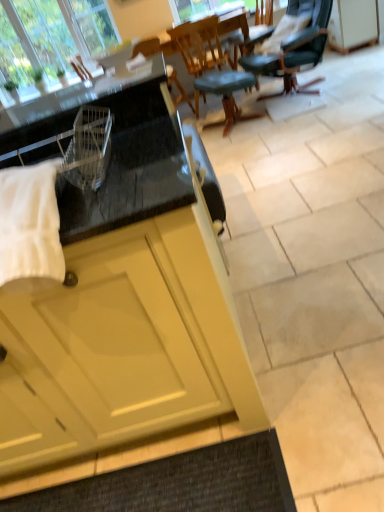
Question: Considering the relative sizes of clear glass window at upper left and wooden chair at center, which appears as the first chair when viewed from the left, in the image provided, is clear glass window at upper left wider than wooden chair at center, which appears as the first chair when viewed from the left,?

Choices:
 (A) yes
 (B) no

Answer: (B)

Question: Can you confirm if clear glass window at upper left is thinner than wooden chair at center, which appears as the second chair when viewed from the right?

Choices:
 (A) yes
 (B) no

Answer: (A)

Question: Considering the relative sizes of clear glass window at upper left and wooden chair at center, which appears as the second chair when viewed from the right, in the image provided, is clear glass window at upper left smaller than wooden chair at center, which appears as the second chair when viewed from the right,?

Choices:
 (A) no
 (B) yes

Answer: (B)

Question: Is clear glass window at upper left positioned behind wooden chair at center, which appears as the first chair when viewed from the left?

Choices:
 (A) no
 (B) yes

Answer: (B)

Question: Does clear glass window at upper left appear on the right side of wooden chair at center, which appears as the second chair when viewed from the right?

Choices:
 (A) yes
 (B) no

Answer: (B)

Question: From a real-world perspective, is clear glass window at upper left on top of wooden chair at center, which appears as the first chair when viewed from the left?

Choices:
 (A) no
 (B) yes

Answer: (B)

Question: Are matte yellow cabinet at upper right, the second cabinetry ordered from the bottom, and green leather office chair at upper right, the second chair when ordered from left to right, beside each other?

Choices:
 (A) no
 (B) yes

Answer: (A)

Question: Is matte yellow cabinet at upper right, the 2th cabinetry viewed from the front, to the right of green leather office chair at upper right, positioned as the first chair in right-to-left order, from the viewer's perspective?

Choices:
 (A) no
 (B) yes

Answer: (B)

Question: Does matte yellow cabinet at upper right, the second cabinetry ordered from the bottom, have a greater height compared to green leather office chair at upper right, the second chair when ordered from left to right?

Choices:
 (A) yes
 (B) no

Answer: (B)

Question: Is matte yellow cabinet at upper right, the 2th cabinetry viewed from the front, positioned with its back to green leather office chair at upper right, positioned as the first chair in right-to-left order?

Choices:
 (A) no
 (B) yes

Answer: (A)

Question: From a real-world perspective, is matte yellow cabinet at upper right, marked as the first cabinetry in a top-to-bottom arrangement, physically below green leather office chair at upper right, positioned as the first chair in right-to-left order?

Choices:
 (A) yes
 (B) no

Answer: (A)

Question: Considering the relative sizes of matte yellow cabinet at upper right, which is counted as the first cabinetry, starting from the back, and green leather office chair at upper right, positioned as the first chair in right-to-left order, in the image provided, is matte yellow cabinet at upper right, which is counted as the first cabinetry, starting from the back, smaller than green leather office chair at upper right, positioned as the first chair in right-to-left order,?

Choices:
 (A) yes
 (B) no

Answer: (A)

Question: Is wooden chair at center, which appears as the first chair when viewed from the left, at the right side of matte yellow cabinet at upper right, which is counted as the first cabinetry, starting from the back?

Choices:
 (A) no
 (B) yes

Answer: (A)